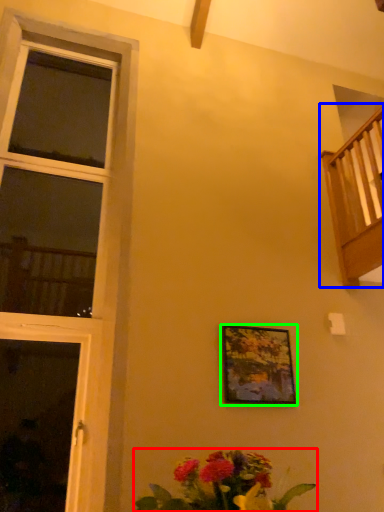
Question: Which is farther away from floral arrangement (highlighted by a red box)? balcony (highlighted by a blue box) or picture frame (highlighted by a green box)?

Choices:
 (A) balcony
 (B) picture frame

Answer: (A)